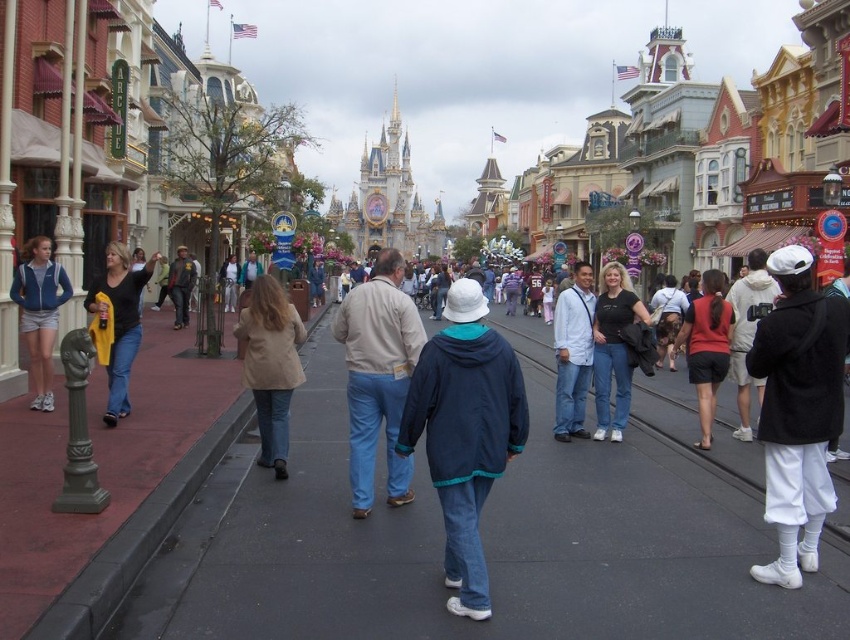
You are standing on the walkway in the theme park scene and want to place a small bench exactly at the center of the black asphalt at center. According to the scene description, where should you position the bench in terms of coordinates?

The bench should be placed at coordinates point (483, 544), which is the 2D location of the black asphalt at center.

You are standing on the walkway and see the black asphalt at center and the red fabric shorts at center. Which object is positioned to the left?

The black asphalt at center is to the left of red fabric shorts at center.

You are a photographer trying to capture a photo of both the navy blue jacket at center and the matte black jacket at center in the same frame. Based on their positions, which jacket should you focus on first to ensure both are in the shot?

The navy blue jacket at center is located below the matte black jacket at center. To capture both in the same frame, focus on the matte black jacket at center first as it is higher up, then adjust the camera angle downward to include the navy blue jacket at center.